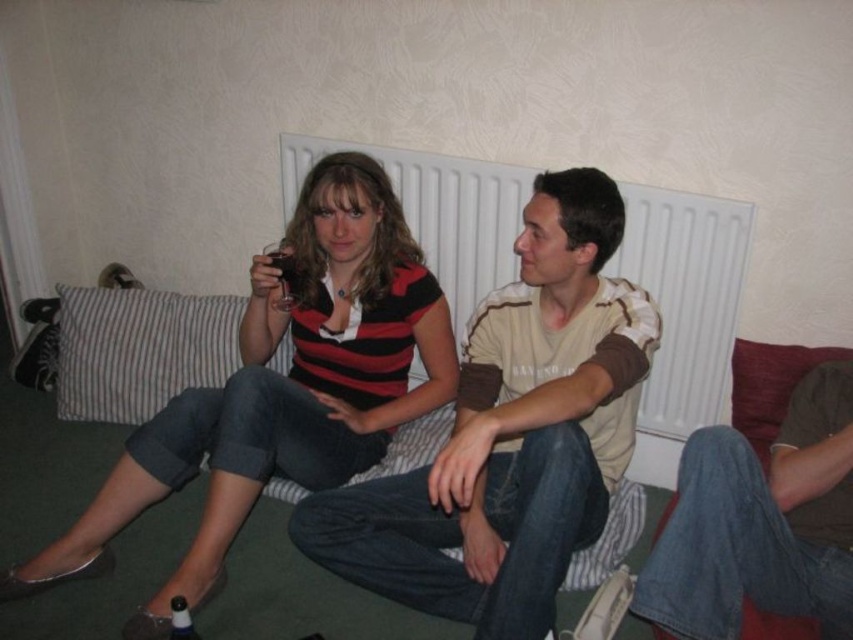
Who is positioned more to the left, white textured radiator at center or jeans at lower right?

From the viewer's perspective, white textured radiator at center appears more on the left side.

Between white textured radiator at center and jeans at lower right, which one has more height?

white textured radiator at center is taller.

Is point (379, 152) less distant than point (825, 410)?

No, (379, 152) is behind (825, 410).

Where is `white textured radiator at center`? white textured radiator at center is located at coordinates (685, 298).

Between matte beige t-shirt at center and matte striped shirt at center, which one has more height?

With more height is matte striped shirt at center.

Which of these two, matte beige t-shirt at center or matte striped shirt at center, stands shorter?

Standing shorter between the two is matte beige t-shirt at center.

Who is more distant from viewer, (374,531) or (160,440)?

The point (160,440) is more distant.

Identify the location of matte beige t-shirt at center. (511, 435).

Which is above, matte beige t-shirt at center or jeans at lower right?

matte beige t-shirt at center

You are a GUI agent. You are given a task and a screenshot of the screen. Output one action in this format:
    pyautogui.click(x=<x>, y=<y>)
    Task: Click on the matte beige t-shirt at center
    
    Given the screenshot: What is the action you would take?
    pyautogui.click(x=511, y=435)

Where is `matte beige t-shirt at center`? matte beige t-shirt at center is located at coordinates (511, 435).